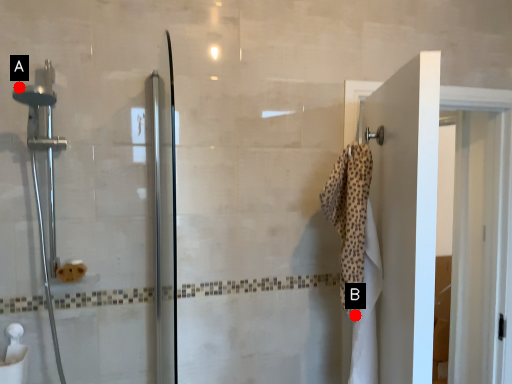
Question: Two points are circled on the image, labeled by A and B beside each circle. Which of the following is the farthest from the observer?

Choices:
 (A) A is further
 (B) B is further

Answer: (B)